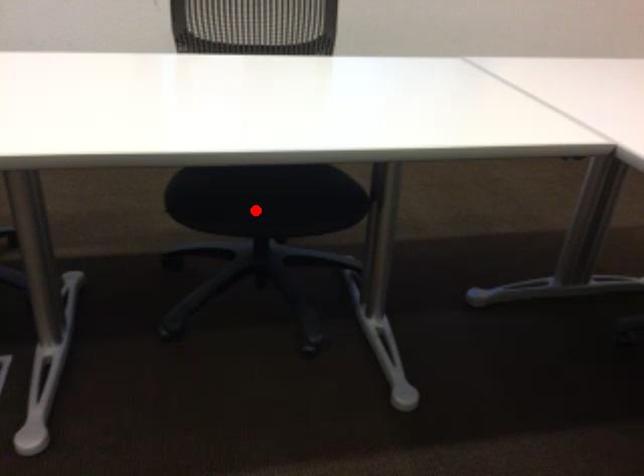
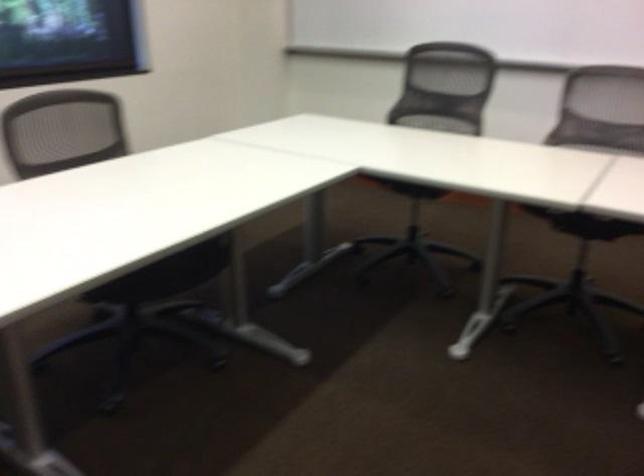
Question: I am providing you with two images of the same scene from different viewpoints. Given a red point in image1, look at the same physical point in image2. Is it:

Choices:
 (A) Closer to the viewpoint
 (B) Farther from the viewpoint

Answer: (B)